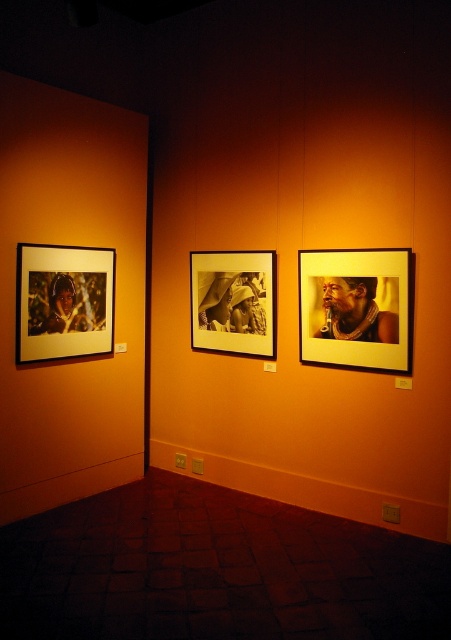
You are standing in the gallery and want to hang a new artwork that is 1.5 meters wide. The existing matte glass photo frame at center right is positioned at point (355, 307). Can you place the new artwork to the right of the matte glass photo frame at center right without overlapping?

The point (355, 307) corresponds to the matte glass photo frame at center right. Since the new artwork is 1.5 meters wide, you need to ensure there is enough space to its right. However, without knowing the total wall dimensions or the spacing between existing frames, it is impossible to determine if there is sufficient space. Please check the wall measurements before deciding.

You are an interior designer arranging furniture in this space. You need to place a 1.2 meter tall sculpture between the matte glass photo frame at center right and the wooden frame at center. Can the sculpture fit vertically between them?

The matte glass photo frame at center right is shorter than the wooden frame at center. Therefore, the sculpture that is 1.2 meters tall can fit vertically between them as long as the vertical space between the frames accommodates its height.

You are an art curator planning to hang a new painting between the matte glass photo frame at center right and the wooden frame at center. Based on their current positions, where should you place the new painting to maintain symmetry?

The matte glass photo frame at center right is located below the wooden frame at center, so placing the new painting between them would disrupt symmetry. To maintain symmetry, the new painting should be placed above the wooden frame at center to balance the arrangement.